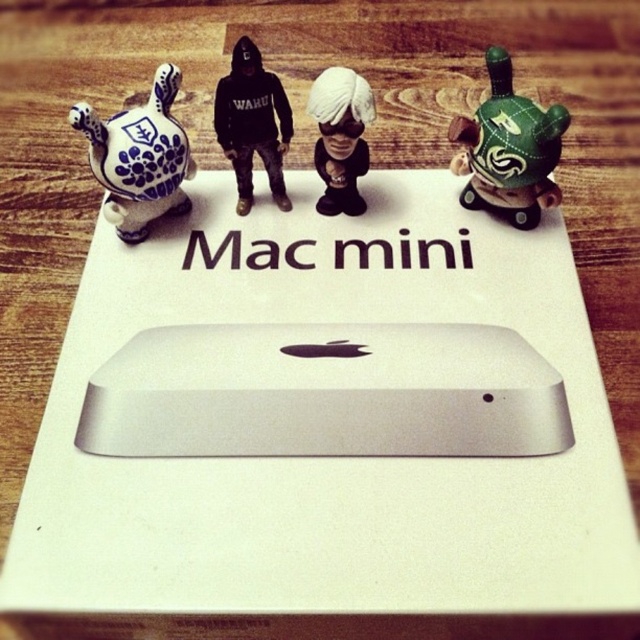
Can you confirm if silver metallic mac mini at center is positioned above green matte turtle at upper right?

Incorrect, silver metallic mac mini at center is not positioned above green matte turtle at upper right.

Who is higher up, silver metallic mac mini at center or green matte turtle at upper right?

green matte turtle at upper right is higher up.

Which is behind, point (292, 330) or point (534, 156)?

Positioned behind is point (534, 156).

The image size is (640, 640). I want to click on silver metallic mac mini at center, so click(x=324, y=392).

Can you confirm if green matte turtle at upper right is positioned below blue and white ceramic duck at left?

Yes, green matte turtle at upper right is below blue and white ceramic duck at left.

Looking at this image, does green matte turtle at upper right have a greater width compared to blue and white ceramic duck at left?

No.

Is point (536, 168) closer to viewer compared to point (173, 88)?

That is True.

Find the location of `green matte turtle at upper right`. green matte turtle at upper right is located at coordinates (508, 148).

Is black hoodie at center shorter than white matte figurine at center?

No, black hoodie at center is not shorter than white matte figurine at center.

Between black hoodie at center and white matte figurine at center, which one appears on the left side from the viewer's perspective?

black hoodie at center is more to the left.

Describe the element at coordinates (252, 122) in the screenshot. I see `black hoodie at center` at that location.

Where is `black hoodie at center`? The width and height of the screenshot is (640, 640). black hoodie at center is located at coordinates (252, 122).